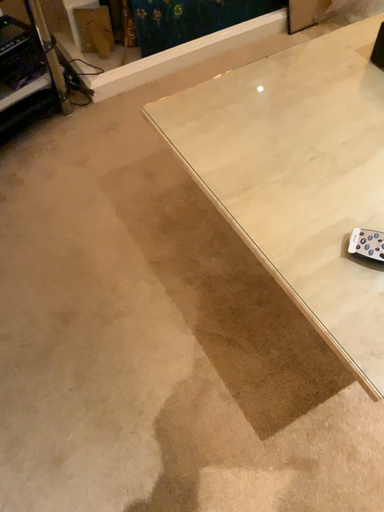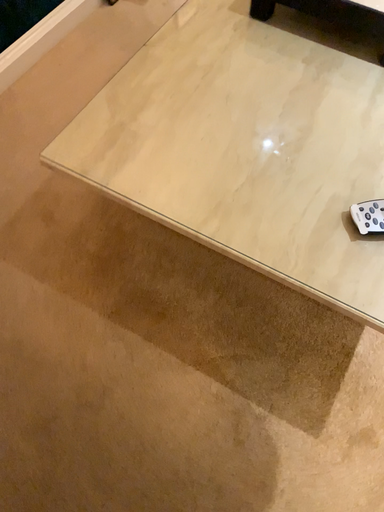
Question: Which way did the camera rotate in the video?

Choices:
 (A) rotated right
 (B) rotated left

Answer: (A)